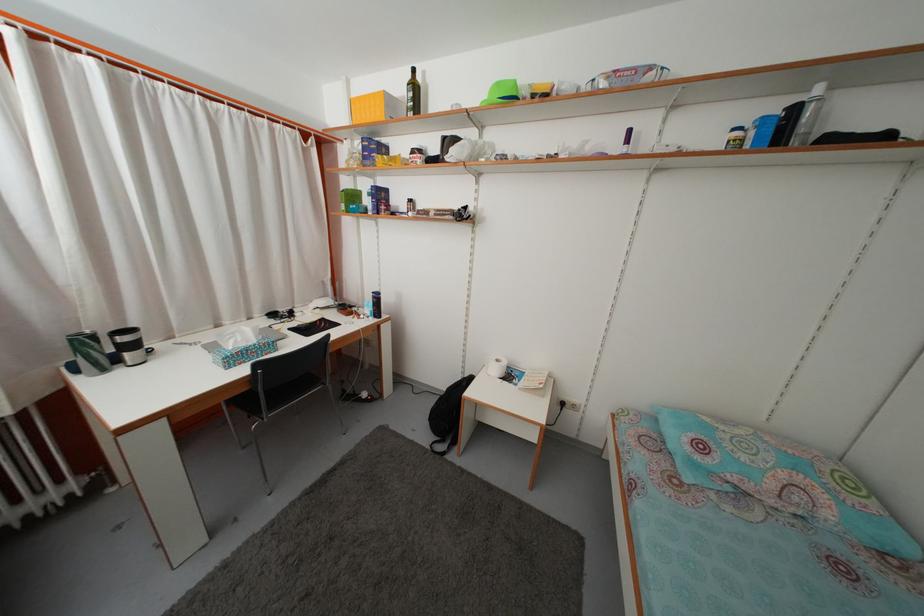
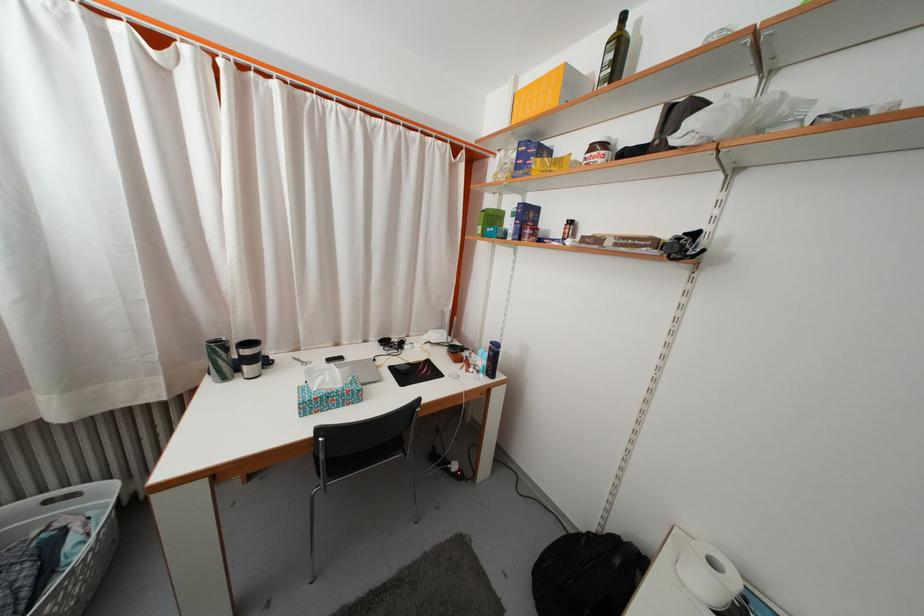
Where in the second image is the point corresponding to pixel 128 346 from the first image?

(251, 359)